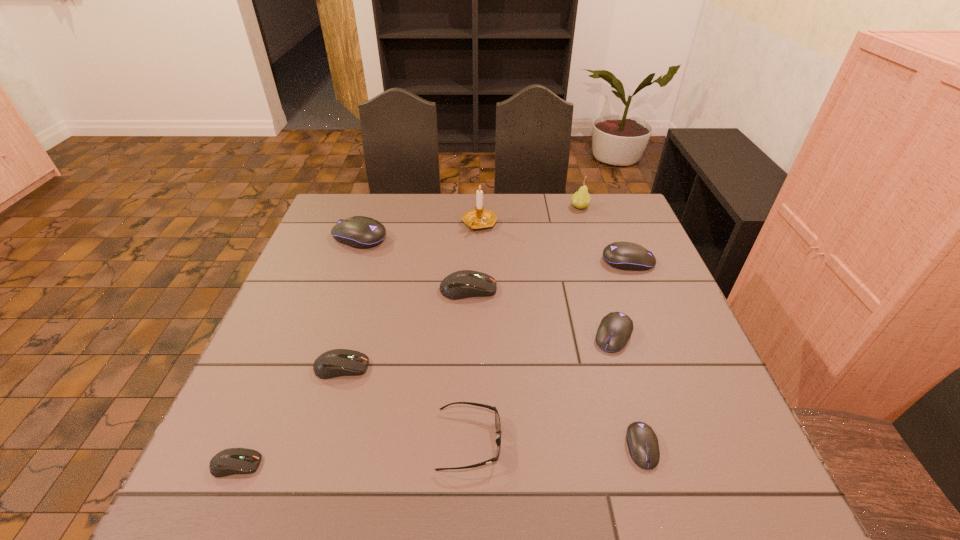
Identify the location of free space located on the right of the farthest black computer mouse. (516, 237).

The image size is (960, 540). I want to click on vacant position located on the button of the biggest dark computer equipment, so click(572, 289).

Where is `free spot located 0.230m on the front of the third nearest black computer mouse`? This screenshot has height=540, width=960. free spot located 0.230m on the front of the third nearest black computer mouse is located at coordinates (658, 334).

What are the coordinates of `free region located on the button of the seventh farthest object` in the screenshot? It's located at (523, 367).

The width and height of the screenshot is (960, 540). I want to click on free location located on the left of the fourth nearest computer mouse, so click(453, 335).

The width and height of the screenshot is (960, 540). What are the coordinates of `free space located 0.100m on the front-facing side of the black sunglasses` in the screenshot? It's located at (554, 441).

Find the location of a particular element. vacant area located on the button of the nearest dark computer equipment is located at coordinates (365, 464).

The width and height of the screenshot is (960, 540). I want to click on vacant area located on the left of the smallest black computer mouse, so click(473, 447).

Identify the location of candle holder that is at the far edge. Image resolution: width=960 pixels, height=540 pixels. (478, 218).

Locate an element on the screen. pear at the far edge is located at coordinates (581, 199).